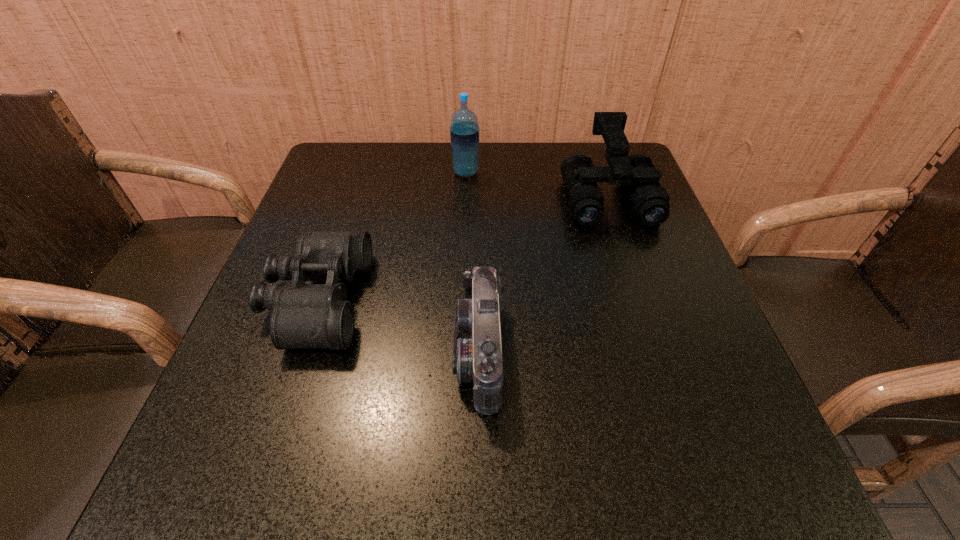
Find the location of a particular element. This screenshot has width=960, height=540. the tallest object is located at coordinates (464, 131).

The image size is (960, 540). I want to click on the second tallest object, so (x=650, y=202).

The width and height of the screenshot is (960, 540). I want to click on the taller binoculars, so click(x=650, y=202).

Locate an element on the screen. The image size is (960, 540). camcorder is located at coordinates (477, 352).

Where is `the leftmost object`? The height and width of the screenshot is (540, 960). the leftmost object is located at coordinates (304, 315).

This screenshot has height=540, width=960. Find the location of `the left binoculars`. the left binoculars is located at coordinates (304, 315).

At what (x,y) coordinates should I click in order to perform the action: click on vacant space positioned 0.080m on the right of the water bottle. Please return your answer as a coordinate pair (x, y). The image size is (960, 540). Looking at the image, I should click on (511, 173).

Where is `vacant space located 0.170m on the front lenses of the third shortest object`? Image resolution: width=960 pixels, height=540 pixels. vacant space located 0.170m on the front lenses of the third shortest object is located at coordinates (637, 285).

You are a GUI agent. You are given a task and a screenshot of the screen. Output one action in this format:
    pyautogui.click(x=<x>, y=<y>)
    Task: Click on the vacant area situated 0.320m on the front-facing side of the camcorder
    
    Given the screenshot: What is the action you would take?
    pyautogui.click(x=267, y=353)

This screenshot has height=540, width=960. Find the location of `free space located on the front-facing side of the camcorder`. free space located on the front-facing side of the camcorder is located at coordinates (331, 353).